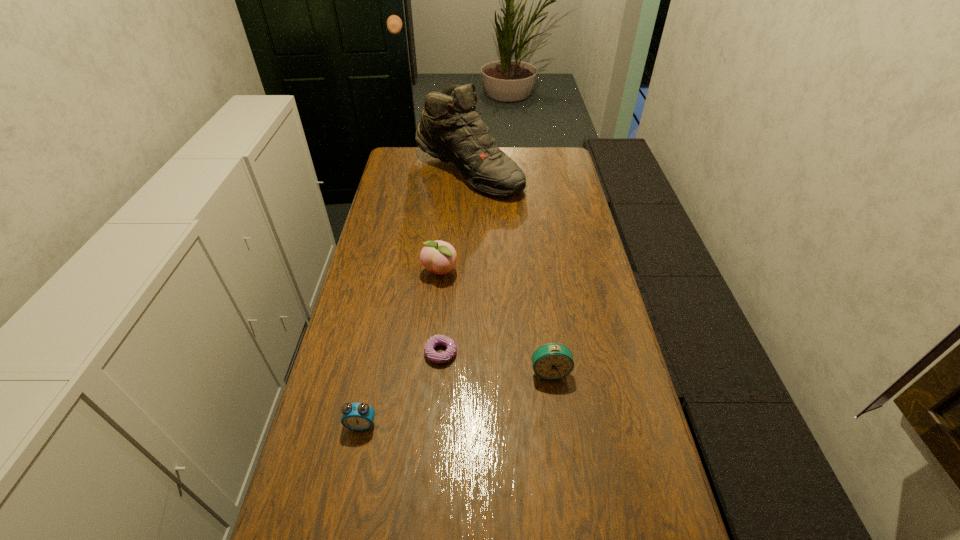
Identify the location of vacant space located on the front-facing side of the right alarm clock. The image size is (960, 540). (569, 517).

Identify the location of blank space located 0.090m on the face of the left alarm clock. The height and width of the screenshot is (540, 960). (352, 469).

Identify the location of free space located 0.140m on the right of the doughnut. The height and width of the screenshot is (540, 960). (507, 353).

At what (x,y) coordinates should I click in order to perform the action: click on object that is positioned at the far edge. Please return your answer as a coordinate pair (x, y). Looking at the image, I should click on (451, 129).

Identify the location of ski boot present at the left edge. (451, 129).

Locate an element on the screen. alarm clock located at the left edge is located at coordinates (355, 416).

Identify the location of object that is at the right edge. (552, 361).

Where is `object that is at the far left corner`? The width and height of the screenshot is (960, 540). object that is at the far left corner is located at coordinates (451, 129).

You are a GUI agent. You are given a task and a screenshot of the screen. Output one action in this format:
    pyautogui.click(x=<x>, y=<y>)
    Task: Click on the free point at the left edge
    
    Given the screenshot: What is the action you would take?
    pyautogui.click(x=331, y=475)

Find the location of `vacant space at the right edge of the desktop`. vacant space at the right edge of the desktop is located at coordinates (554, 212).